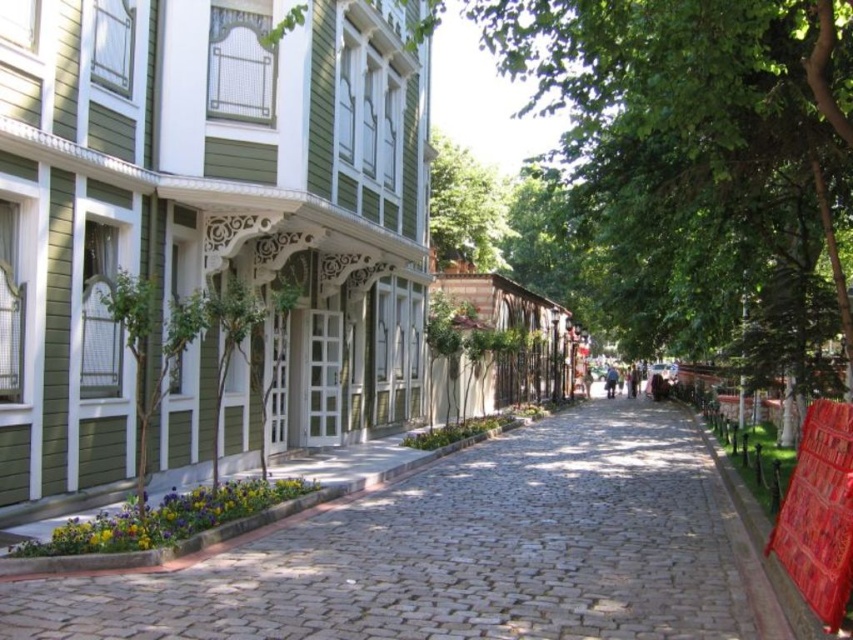
Can you confirm if cobblestone pavement at center is thinner than green leafy tree at center?

Yes.

This screenshot has height=640, width=853. In order to click on cobblestone pavement at center in this screenshot , I will do `click(463, 554)`.

Can you confirm if green leafy tree at center is positioned to the left of green leafy tree at upper center?

Incorrect, green leafy tree at center is not on the left side of green leafy tree at upper center.

Is green leafy tree at center below green leafy tree at upper center?

Incorrect, green leafy tree at center is not positioned below green leafy tree at upper center.

Does point (743, 168) come behind point (508, 193)?

No, (743, 168) is in front of (508, 193).

I want to click on green leafy tree at center, so click(x=697, y=154).

Which is more to the right, cobblestone pavement at center or green leafy tree at upper center?

cobblestone pavement at center

Is cobblestone pavement at center to the left of green leafy tree at upper center from the viewer's perspective?

In fact, cobblestone pavement at center is to the right of green leafy tree at upper center.

Between point (466, 458) and point (432, 211), which one is positioned in front?

Point (466, 458) is more forward.

Identify the location of cobblestone pavement at center. (463, 554).